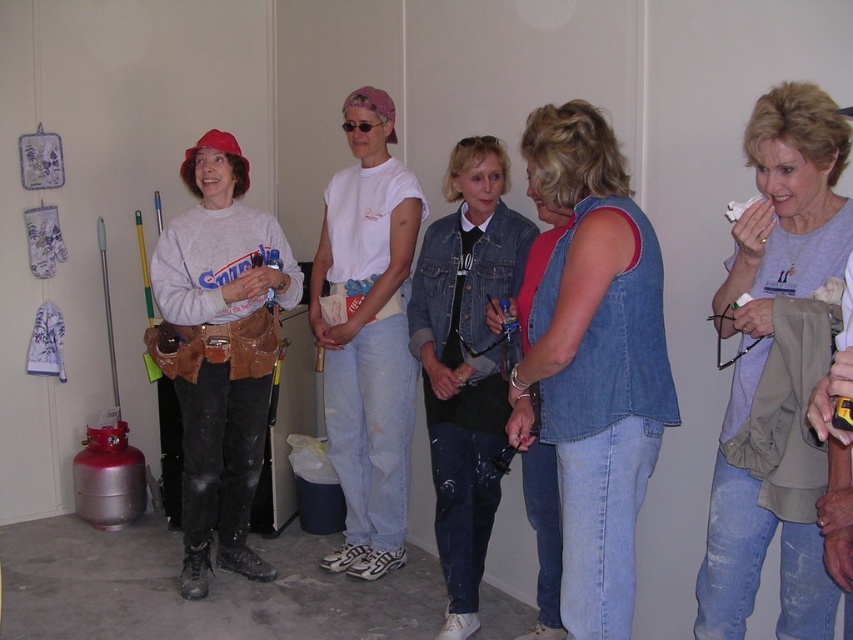
You are standing in the room and want to place a small item exactly at the point labeled as point (593, 360). Which object from the scene will this point be located on?

The point (593, 360) is located on the denim vest at center.

You are standing at the entrance of the room and want to find the denim vest at center. Based on the coordinates provided, in which direction should you look to locate it?

The denim vest at center is located at coordinates point (593, 360), so you should look towards the center of the room to find it.

You are standing in the room and want to move from the point at coordinates (229, 545) to the point at coordinates (753, 508). Which direction should you move to get closer to your destination?

You should move backward because the point at coordinates (229, 545) is closer to you than the point at coordinates (753, 508), so moving backward will take you towards the destination.